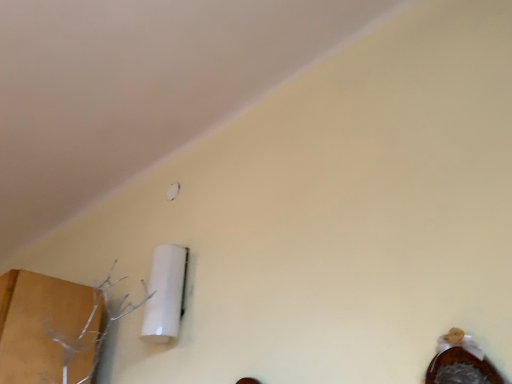
Where is `white glossy light switch at upper left`? white glossy light switch at upper left is located at coordinates (165, 294).

Image resolution: width=512 pixels, height=384 pixels. What do you see at coordinates (165, 294) in the screenshot?
I see `white glossy light switch at upper left` at bounding box center [165, 294].

Measure the distance between white glossy light switch at upper left and camera.

The depth of white glossy light switch at upper left is 1.36 meters.

At what (x,y) coordinates should I click in order to perform the action: click on white glossy light switch at upper left. Please return your answer as a coordinate pair (x, y). Looking at the image, I should click on (165, 294).